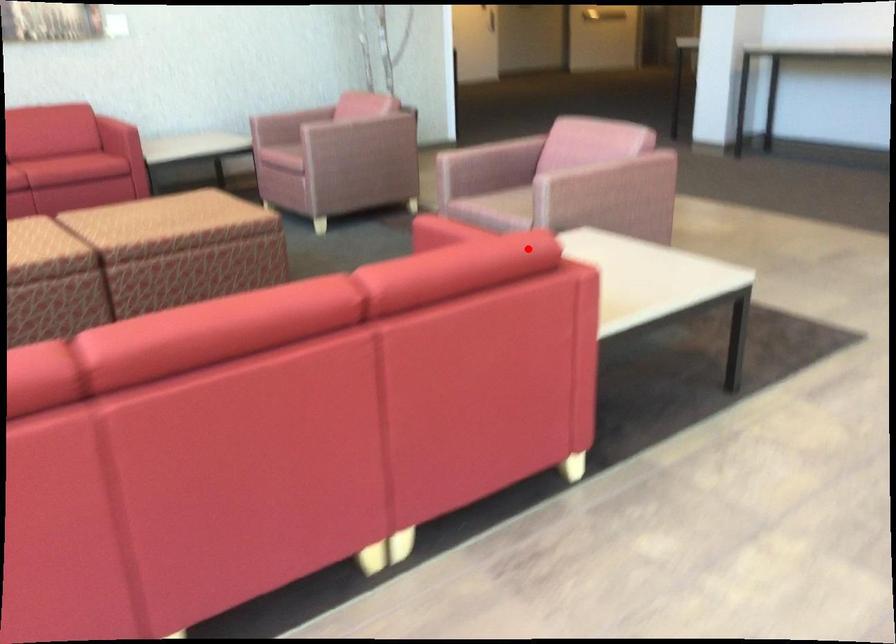
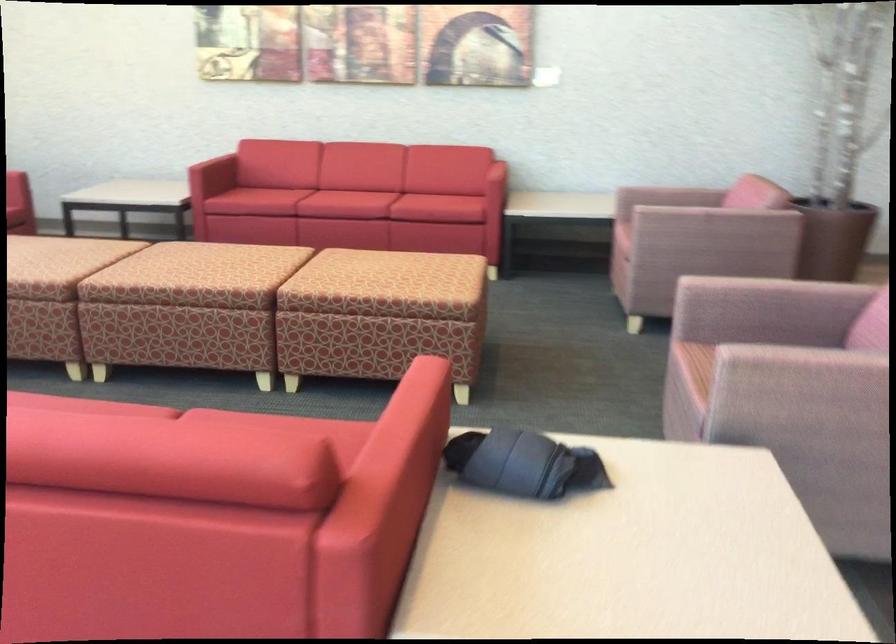
Question: I am providing you with two images of the same scene from different viewpoints. Image1 has a red point marked. In image2, the corresponding 3D location appears at what relative position? Reply with the corresponding letter.

Choices:
 (A) Closer
 (B) Farther

Answer: (A)